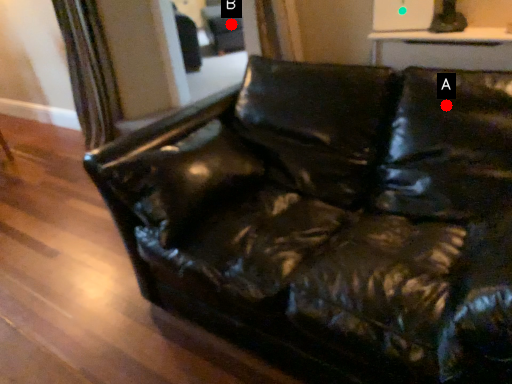
Question: Two points are circled on the image, labeled by A and B beside each circle. Which point appears farthest from the camera in this image?

Choices:
 (A) A is further
 (B) B is further

Answer: (B)